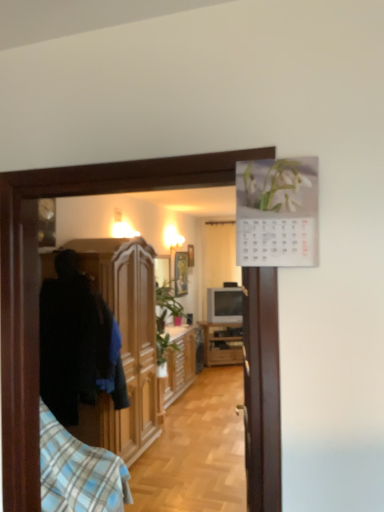
Question: Is blue plaid shirt at left bigger than wooden picture frame at center?

Choices:
 (A) no
 (B) yes

Answer: (B)

Question: Is blue plaid shirt at left turned away from wooden picture frame at center?

Choices:
 (A) yes
 (B) no

Answer: (B)

Question: From a real-world perspective, is blue plaid shirt at left located beneath wooden picture frame at center?

Choices:
 (A) yes
 (B) no

Answer: (A)

Question: Is blue plaid shirt at left at the left side of wooden picture frame at center?

Choices:
 (A) yes
 (B) no

Answer: (A)

Question: Is the position of blue plaid shirt at left less distant than that of wooden picture frame at center?

Choices:
 (A) no
 (B) yes

Answer: (B)

Question: Is point (148, 437) positioned closer to the camera than point (233, 356)?

Choices:
 (A) farther
 (B) closer

Answer: (B)

Question: Is wooden cabinet at left, the third cabinetry in the back-to-front sequence, inside or outside of wooden cabinet at center, the third cabinetry viewed from the front?

Choices:
 (A) inside
 (B) outside

Answer: (B)

Question: From a real-world perspective, is wooden cabinet at left, which is counted as the first cabinetry, starting from the front, above or below wooden cabinet at center, the third cabinetry viewed from the front?

Choices:
 (A) below
 (B) above

Answer: (B)

Question: Considering the positions of wooden cabinet at left, which is counted as the first cabinetry, starting from the front, and wooden cabinet at center, the third cabinetry viewed from the front, in the image, is wooden cabinet at left, which is counted as the first cabinetry, starting from the front, taller or shorter than wooden cabinet at center, the third cabinetry viewed from the front,?

Choices:
 (A) short
 (B) tall

Answer: (B)

Question: From the image's perspective, is white sheer curtain at center located above or below matte gray television at center?

Choices:
 (A) below
 (B) above

Answer: (B)

Question: Is white sheer curtain at center spatially inside matte gray television at center, or outside of it?

Choices:
 (A) inside
 (B) outside

Answer: (B)

Question: In the image, is white sheer curtain at center on the left side or the right side of matte gray television at center?

Choices:
 (A) left
 (B) right

Answer: (B)

Question: Is white sheer curtain at center taller or shorter than matte gray television at center?

Choices:
 (A) tall
 (B) short

Answer: (A)

Question: Considering their positions, is wooden cabinet at left, the third cabinetry in the back-to-front sequence, located in front of or behind white sheer curtain at center?

Choices:
 (A) behind
 (B) front

Answer: (B)

Question: From a real-world perspective, relative to white sheer curtain at center, is wooden cabinet at left, which is counted as the first cabinetry, starting from the front, vertically above or below?

Choices:
 (A) above
 (B) below

Answer: (B)